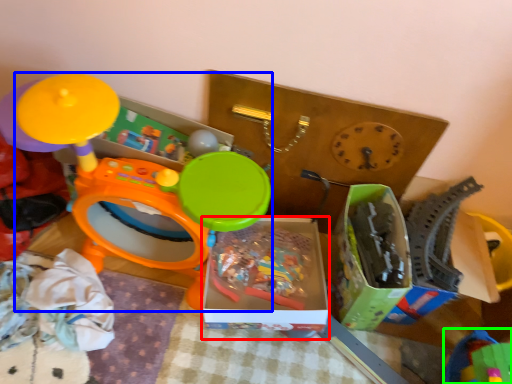
Question: Based on their relative distances, which object is nearer to storage box (highlighted by a red box)? Choose from toy (highlighted by a blue box) and toy (highlighted by a green box).

Choices:
 (A) toy
 (B) toy

Answer: (A)